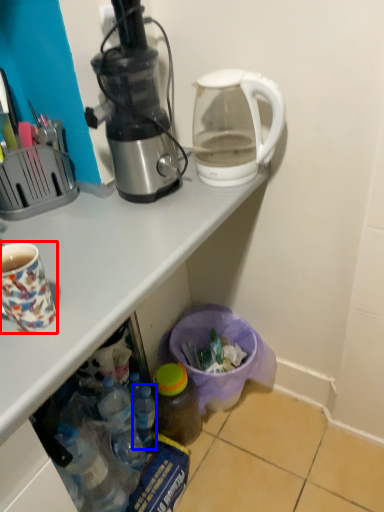
Question: Which point is further to the camera, coffee cup (highlighted by a red box) or bottle (highlighted by a blue box)?

Choices:
 (A) coffee cup
 (B) bottle

Answer: (B)